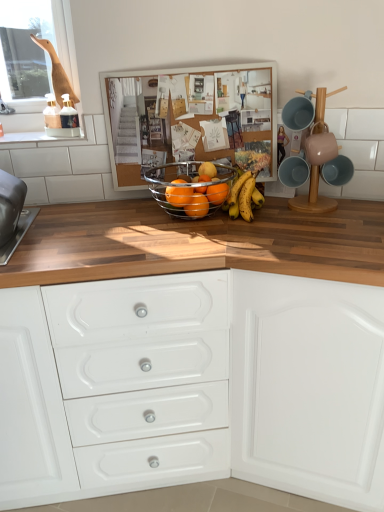
Locate an element on the screen. free location to the right of metallic orange fruit at center, the 3th orange from the right is located at coordinates (246, 224).